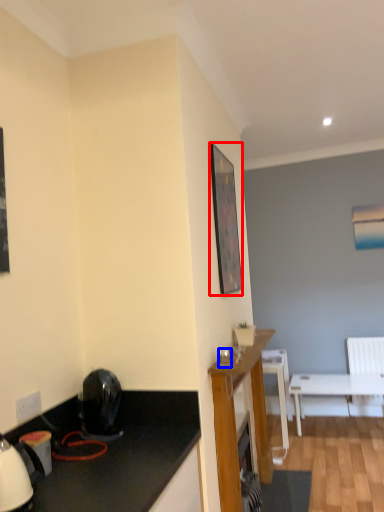
Question: Which point is further to the camera, picture frame (highlighted by a red box) or coffee cup (highlighted by a blue box)?

Choices:
 (A) picture frame
 (B) coffee cup

Answer: (A)